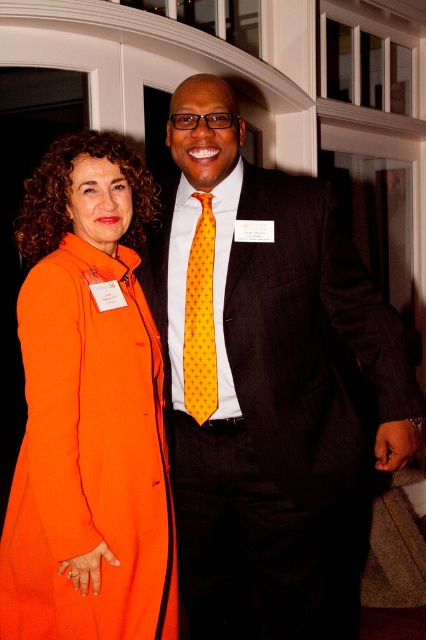
In the scene shown: You are organizing a photo shoot and need to ensure that the orange fabric coat at left and the yellow dotted tie at center are visible in the frame. Given that the camera can only capture items wider than 10 cm, can both items be captured clearly?

The orange fabric coat at left is wider than the yellow dotted tie at center. Since the camera requires items to be wider than 10 cm, both items can be captured clearly as long as their widths individually meet the minimum requirement. However, the provided information does not specify the exact widths, only the comparison between them. Without knowing the exact width of either item, it is impossible to confirm if both meet the 10 cm threshold.